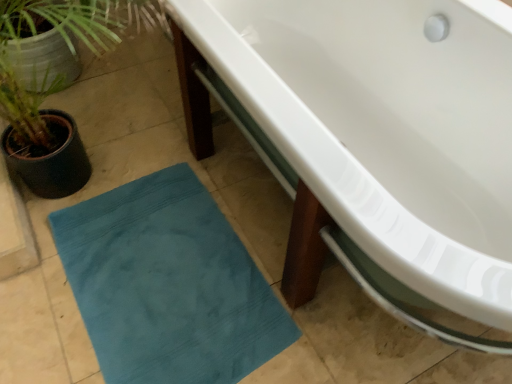
The image size is (512, 384). Describe the element at coordinates (374, 140) in the screenshot. I see `white glossy bathtub at center` at that location.

The width and height of the screenshot is (512, 384). Identify the location of white glossy bathtub at center. (374, 140).

Is point (79, 169) positioned after point (433, 238)?

Yes.

Is green textured plant at left far away from white glossy bathtub at center?

No, green textured plant at left is not far away from white glossy bathtub at center.

In the scene shown: Considering the relative sizes of green textured plant at left and white glossy bathtub at center in the image provided, is green textured plant at left wider than white glossy bathtub at center?

Incorrect, the width of green textured plant at left does not surpass that of white glossy bathtub at center.

Who is smaller, green textured plant at left or white glossy bathtub at center?

With smaller size is green textured plant at left.

Considering the positions of objects white glossy bathtub at center and green textured plant at left in the image provided, who is more to the left, white glossy bathtub at center or green textured plant at left?

green textured plant at left is more to the left.

From the image's perspective, who appears lower, white glossy bathtub at center or green textured plant at left?

green textured plant at left is shown below in the image.

Considering the sizes of objects white glossy bathtub at center and green textured plant at left in the image provided, who is bigger, white glossy bathtub at center or green textured plant at left?

white glossy bathtub at center.

Is white glossy bathtub at center spatially inside green textured plant at left, or outside of it?

The correct answer is: outside.

What's the angular difference between white glossy bathtub at center and teal fabric bath mat at lower left's facing directions?

The facing directions of white glossy bathtub at center and teal fabric bath mat at lower left are 3.5 degrees apart.

Is white glossy bathtub at center far away from teal fabric bath mat at lower left?

No, white glossy bathtub at center is not far from teal fabric bath mat at lower left.

From a real-world perspective, between white glossy bathtub at center and teal fabric bath mat at lower left, who is vertically higher?

In real-world perspective, white glossy bathtub at center is above.

Is point (374, 209) less distant than point (139, 270)?

Yes, it is in front of point (139, 270).

Is teal fabric bath mat at lower left positioned far away from green textured plant at left?

teal fabric bath mat at lower left is actually quite close to green textured plant at left.

From the image's perspective, is teal fabric bath mat at lower left located above or below green textured plant at left?

teal fabric bath mat at lower left is below green textured plant at left.

From a real-world perspective, is teal fabric bath mat at lower left under green textured plant at left?

Yes, from a real-world perspective, teal fabric bath mat at lower left is under green textured plant at left.

Which is behind, point (75, 264) or point (3, 27)?

The point (75, 264) is farther.

Looking at their sizes, would you say teal fabric bath mat at lower left is wider or thinner than white glossy bathtub at center?

In the image, teal fabric bath mat at lower left appears to be more narrow than white glossy bathtub at center.

Considering the relative positions of teal fabric bath mat at lower left and white glossy bathtub at center in the image provided, is teal fabric bath mat at lower left behind white glossy bathtub at center?

Yes, it is.

Does teal fabric bath mat at lower left have a larger size compared to white glossy bathtub at center?

Actually, teal fabric bath mat at lower left might be smaller than white glossy bathtub at center.

Which is behind, point (81, 149) or point (239, 377)?

The point (81, 149) is more distant.

Which of these two, green textured plant at left or teal fabric bath mat at lower left, is wider?

With larger width is green textured plant at left.

The width and height of the screenshot is (512, 384). Identify the location of houseplant on the left side of white glossy bathtub at center. (56, 85).

The width and height of the screenshot is (512, 384). There is a white glossy bathtub at center. In order to click on houseplant above it (from a real-world perspective) in this screenshot , I will do `click(56, 85)`.

Based on the photo, when comparing their distances from green textured plant at left, does teal fabric bath mat at lower left or white glossy bathtub at center seem closer?

The object closer to green textured plant at left is teal fabric bath mat at lower left.

Considering their positions, is white glossy bathtub at center positioned closer to teal fabric bath mat at lower left than green textured plant at left?

green textured plant at left.

When comparing their distances from white glossy bathtub at center, does green textured plant at left or teal fabric bath mat at lower left seem further?

The object further to white glossy bathtub at center is green textured plant at left.

From the image, which object appears to be nearer to teal fabric bath mat at lower left, green textured plant at left or white glossy bathtub at center?

The object closer to teal fabric bath mat at lower left is green textured plant at left.

Based on their spatial positions, is white glossy bathtub at center or teal fabric bath mat at lower left closer to green textured plant at left?

teal fabric bath mat at lower left lies closer to green textured plant at left than the other object.

Considering their positions, is teal fabric bath mat at lower left positioned further to white glossy bathtub at center than green textured plant at left?

green textured plant at left.

Locate an element on the screen. The width and height of the screenshot is (512, 384). bath mat between green textured plant at left and white glossy bathtub at center is located at coordinates point(168,284).